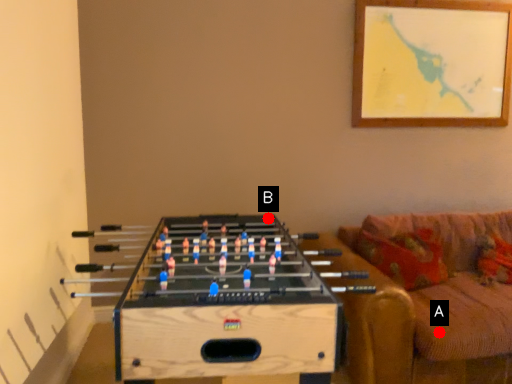
Question: Two points are circled on the image, labeled by A and B beside each circle. Among these points, which one is farthest from the camera?

Choices:
 (A) A is further
 (B) B is further

Answer: (B)